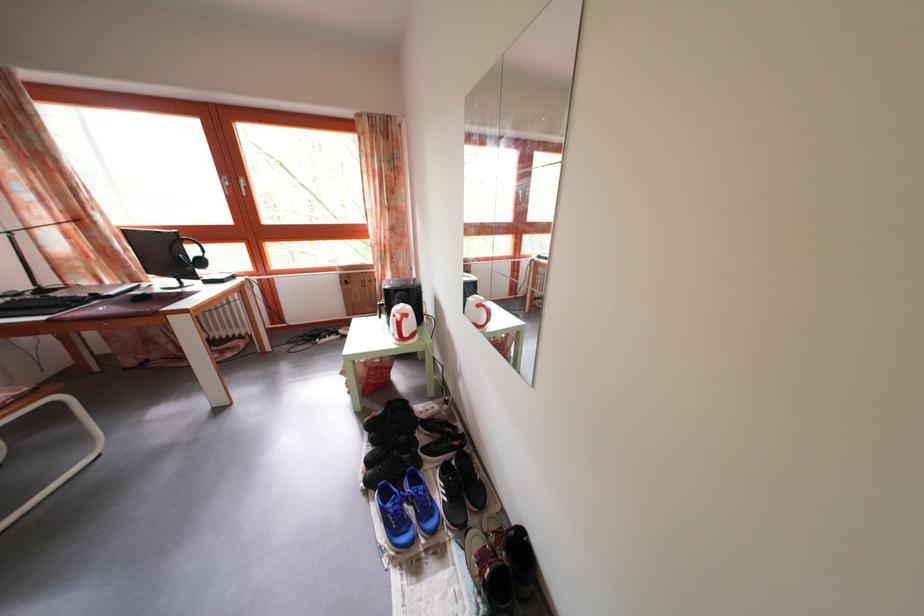
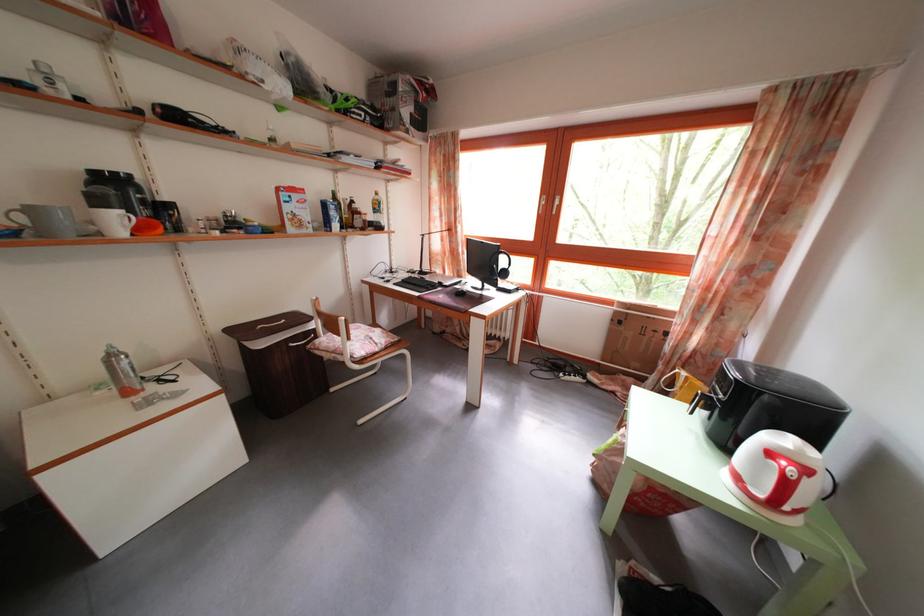
Where in the second image is the point corresponding to point (348, 283) from the first image?

(623, 320)